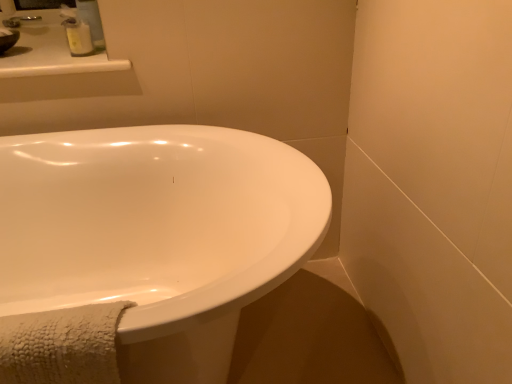
Question: In the image, is white plastic soap dispenser at upper left positioned in front of or behind white glossy bathtub at lower left?

Choices:
 (A) behind
 (B) front

Answer: (A)

Question: In terms of height, does white plastic soap dispenser at upper left look taller or shorter compared to white glossy bathtub at lower left?

Choices:
 (A) tall
 (B) short

Answer: (B)

Question: Estimate the real-world distances between objects in this image. Which object is closer to the white plastic soap dispenser at upper left?

Choices:
 (A) white glossy bathtub at lower left
 (B) matte white sink at upper left

Answer: (B)

Question: Which object is positioned farthest from the matte white sink at upper left?

Choices:
 (A) white plastic soap dispenser at upper left
 (B) white glossy bathtub at lower left

Answer: (B)